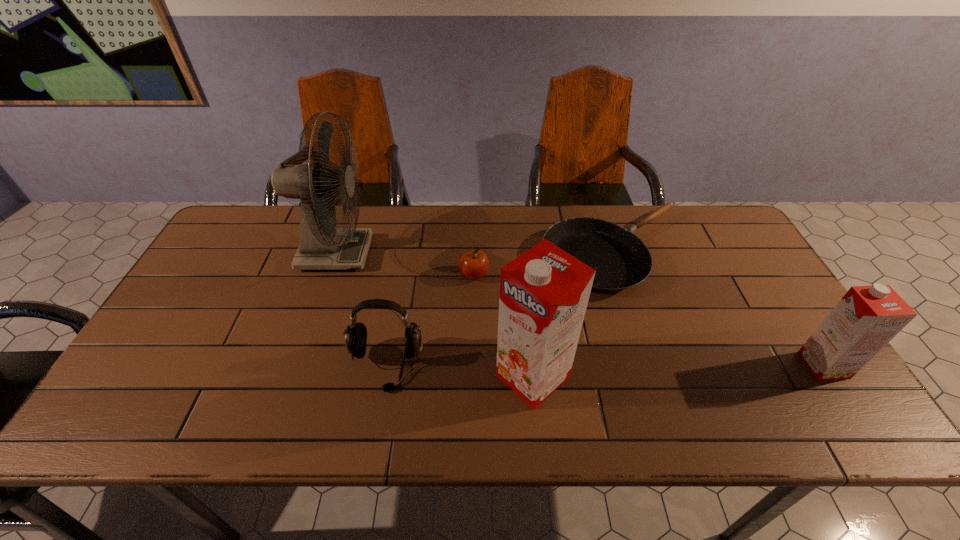
I want to click on vacant point located between the frying pan and the right carton, so click(x=720, y=308).

Identify which object is the third closest to the second shortest object. Please provide its 2D coordinates. Your answer should be formatted as a tuple, i.e. [(x, y)], where the tuple contains the x and y coordinates of a point satisfying the conditions above.

[(544, 292)]

Select which object appears as the second closest to the headset. Please provide its 2D coordinates. Your answer should be formatted as a tuple, i.e. [(x, y)], where the tuple contains the x and y coordinates of a point satisfying the conditions above.

[(544, 292)]

Where is `vacant point that satisfies the following two spatial constraints: 1. on the front-facing side of the left carton; 2. on the right side of the fan`? vacant point that satisfies the following two spatial constraints: 1. on the front-facing side of the left carton; 2. on the right side of the fan is located at coordinates (294, 376).

This screenshot has height=540, width=960. Find the location of `vacant region that satisfies the following two spatial constraints: 1. on the front side of the frying pan; 2. on the left side of the fourth shortest object`. vacant region that satisfies the following two spatial constraints: 1. on the front side of the frying pan; 2. on the left side of the fourth shortest object is located at coordinates [x=653, y=365].

Identify the location of blank area in the image that satisfies the following two spatial constraints: 1. on the front-facing side of the leftmost object; 2. on the left side of the right carton. This screenshot has width=960, height=540. (297, 365).

You are a GUI agent. You are given a task and a screenshot of the screen. Output one action in this format:
    pyautogui.click(x=<x>, y=<y>)
    Task: Click on the free space that satisfies the following two spatial constraints: 1. on the front-facing side of the leftmost object; 2. on the left side of the third tallest object
    The image size is (960, 540).
    Given the screenshot: What is the action you would take?
    pyautogui.click(x=297, y=365)